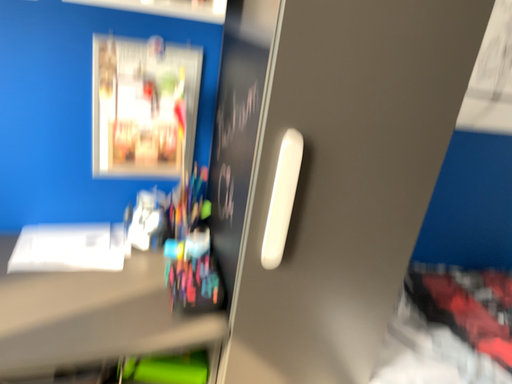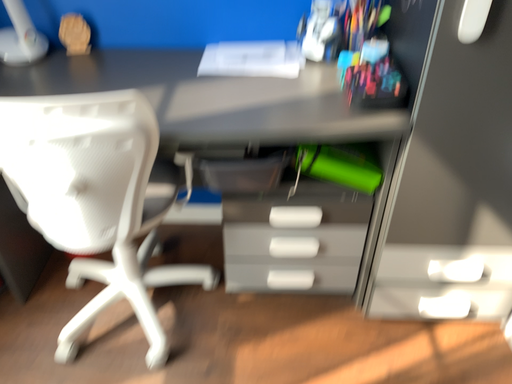
Question: How did the camera likely rotate when shooting the video?

Choices:
 (A) rotated left
 (B) rotated right

Answer: (A)